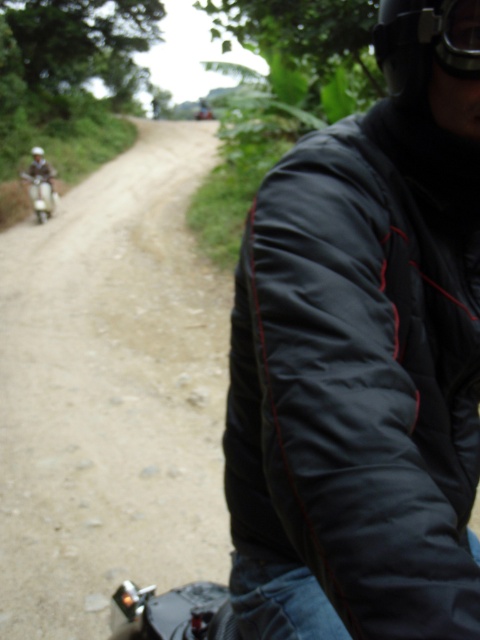
You are a passenger on a motorbike ride through a forest. You notice two objects in the scene. One is the black matte helmet at upper right and the other is the matte white scooter at left. Which of these two objects is positioned to the right side of the other?

The black matte helmet at upper right is positioned to the right of the matte white scooter at left.

You are a photographer trying to capture a photo of both the black puffy jacket at right and the matte white scooter at left. Since you want to ensure both are in focus, you need to know which object is narrower. Which one is thinner?

The black puffy jacket at right is thinner than the matte white scooter at left, so you should adjust your camera settings to focus on the narrower object first.

You are a photographer trying to capture a photo of the matte white scooter at left and the black matte helmet at upper right. Based on their positions, which object should you focus on first to ensure both are in sharp focus?

The black matte helmet at upper right is closer to the viewer than the matte white scooter at left, so you should focus on the black matte helmet at upper right first to ensure both are in sharp focus.